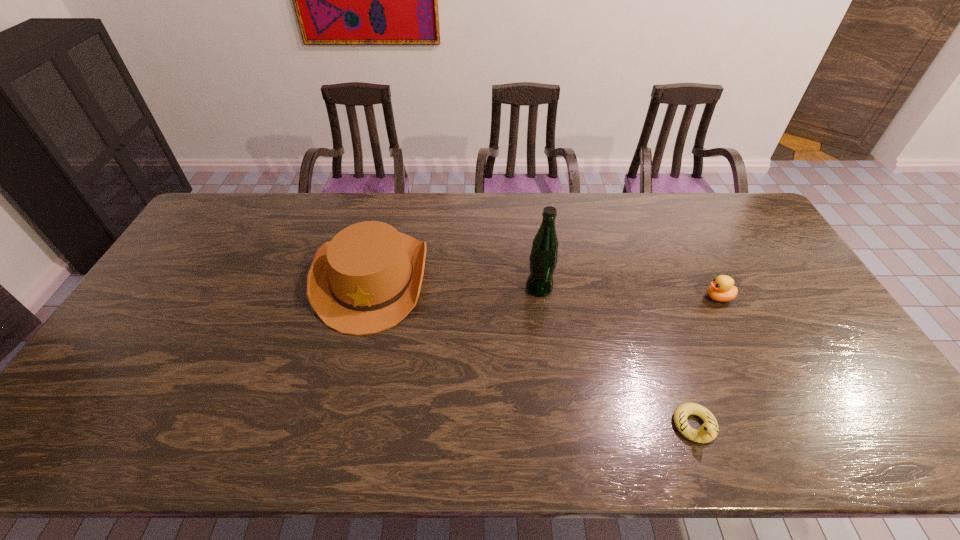
I want to click on vacant space at the far right corner of the desktop, so click(738, 228).

The image size is (960, 540). What are the coordinates of `vacant space at the near right corner of the desktop` in the screenshot? It's located at (841, 442).

Find the location of `free space between the tallest object and the rightmost object`. free space between the tallest object and the rightmost object is located at coordinates (629, 293).

Find the location of `empty location between the left duckling and the farther duckling`. empty location between the left duckling and the farther duckling is located at coordinates (707, 362).

The image size is (960, 540). I want to click on free point between the taller duckling and the beer bottle, so (629, 293).

Locate an element on the screen. This screenshot has width=960, height=540. free point between the second tallest object and the second object from left to right is located at coordinates (456, 282).

You are a GUI agent. You are given a task and a screenshot of the screen. Output one action in this format:
    pyautogui.click(x=<x>, y=<y>)
    Task: Click on the vacant area that lies between the left duckling and the farther duckling
    This screenshot has width=960, height=540.
    Given the screenshot: What is the action you would take?
    pyautogui.click(x=707, y=362)

Where is `free space between the third object from left to right and the rightmost object`? free space between the third object from left to right and the rightmost object is located at coordinates (707, 362).

Where is `free space between the third object from right to left and the leftmost object`? The height and width of the screenshot is (540, 960). free space between the third object from right to left and the leftmost object is located at coordinates (456, 282).

Find the location of a particular element. The height and width of the screenshot is (540, 960). object that stands as the second closest to the third shortest object is located at coordinates point(708,431).